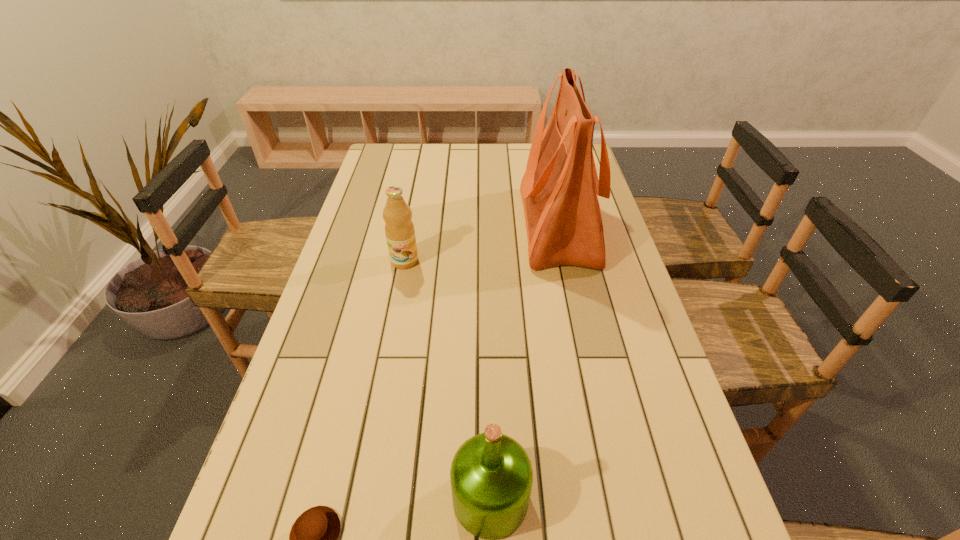
Image resolution: width=960 pixels, height=540 pixels. In order to click on free space at the left edge of the desktop in this screenshot , I will do `click(346, 286)`.

What are the coordinates of `free space at the right edge of the desktop` in the screenshot? It's located at (607, 246).

In the image, there is a desktop. At what (x,y) coordinates should I click in order to perform the action: click on vacant space at the far left corner. Please return your answer as a coordinate pair (x, y). This screenshot has height=540, width=960. Looking at the image, I should click on (402, 150).

The width and height of the screenshot is (960, 540). In order to click on object that stands as the third closest to the muffin in this screenshot , I will do `click(559, 189)`.

The height and width of the screenshot is (540, 960). Identify the location of the closest object to the right olive oil. (313, 539).

Where is `free point that satisfies the following two spatial constraints: 1. on the front pocket of the shopping bag; 2. on the label of the farther olive oil`? This screenshot has width=960, height=540. free point that satisfies the following two spatial constraints: 1. on the front pocket of the shopping bag; 2. on the label of the farther olive oil is located at coordinates (565, 261).

What are the coordinates of `free space that satisfies the following two spatial constraints: 1. on the front pocket of the shopping bag; 2. on the label of the farther olive oil` in the screenshot? It's located at (565, 261).

Identify the location of free space in the image that satisfies the following two spatial constraints: 1. on the front pocket of the tallest object; 2. on the label of the left olive oil. This screenshot has width=960, height=540. (565, 261).